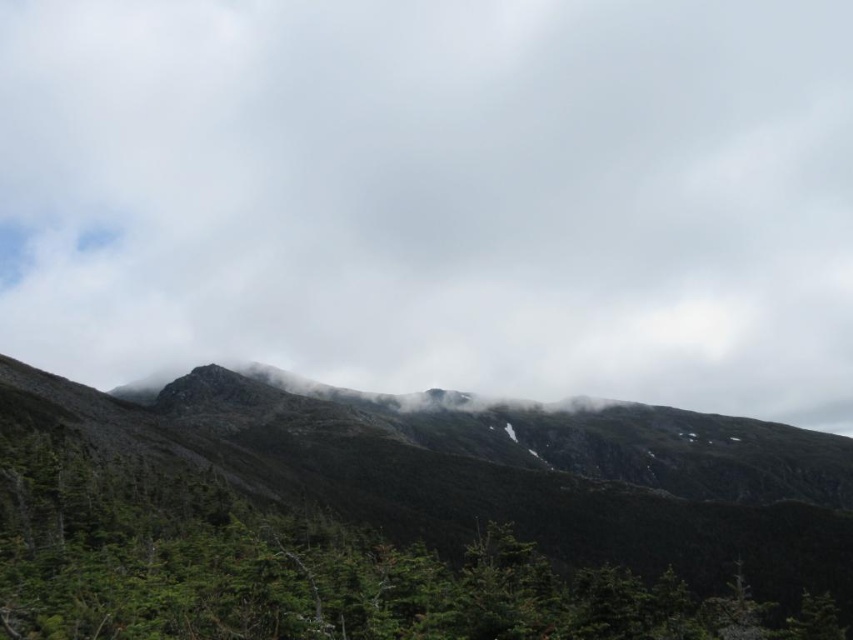
Which of these two, white fluffy cloud at upper center or green matte tree at center, stands taller?

white fluffy cloud at upper center

The width and height of the screenshot is (853, 640). What do you see at coordinates (436, 195) in the screenshot?
I see `white fluffy cloud at upper center` at bounding box center [436, 195].

What are the coordinates of `white fluffy cloud at upper center` in the screenshot? It's located at (436, 195).